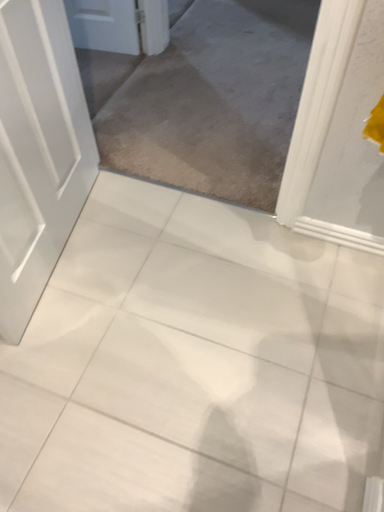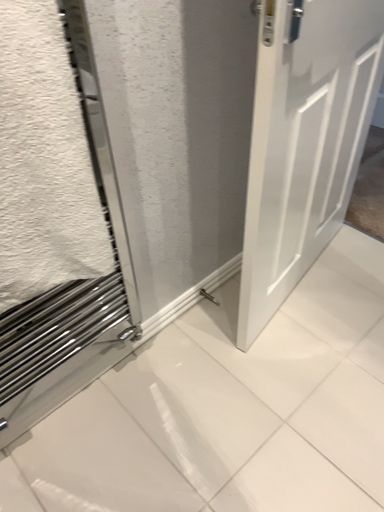
Question: How did the camera likely rotate when shooting the video?

Choices:
 (A) rotated right
 (B) rotated left

Answer: (B)